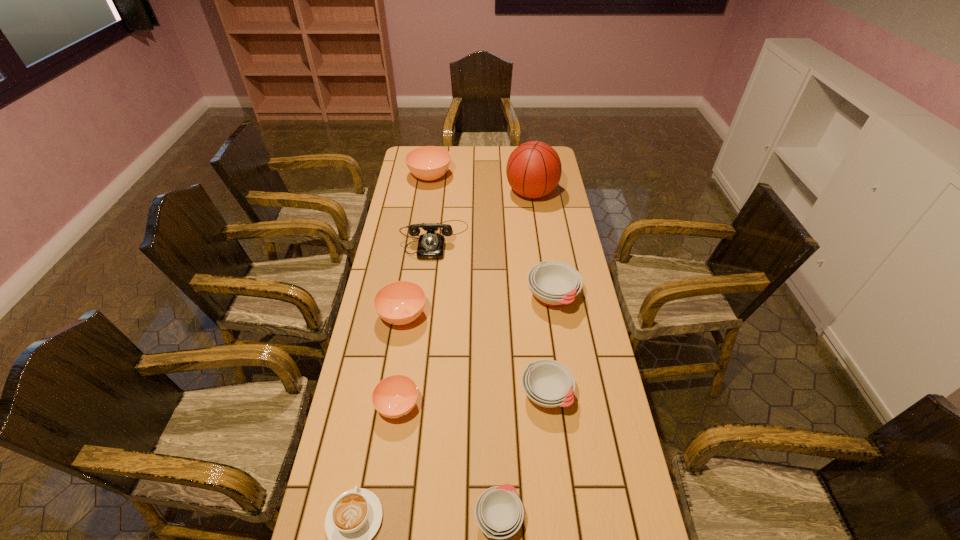
Locate an element on the screen. This screenshot has width=960, height=540. the tallest object is located at coordinates (533, 170).

The image size is (960, 540). I want to click on the farthest soup bowl, so click(x=428, y=163).

This screenshot has width=960, height=540. I want to click on the biggest peach soup bowl, so click(x=428, y=163).

The height and width of the screenshot is (540, 960). What are the coordinates of `telephone` in the screenshot? It's located at [431, 245].

Locate an element on the screen. The image size is (960, 540). the farthest white soup bowl is located at coordinates (554, 283).

At what (x,y) coordinates should I click in order to perform the action: click on the second biggest peach soup bowl. Please return your answer as a coordinate pair (x, y). Image resolution: width=960 pixels, height=540 pixels. Looking at the image, I should click on (399, 303).

Find the location of a particular element. This screenshot has height=540, width=960. the second farthest white soup bowl is located at coordinates (548, 383).

The width and height of the screenshot is (960, 540). In order to click on the smallest peach soup bowl in this screenshot , I will do `click(395, 396)`.

Where is `free space located 0.090m on the front of the tallest object`? The width and height of the screenshot is (960, 540). free space located 0.090m on the front of the tallest object is located at coordinates (536, 222).

You are a GUI agent. You are given a task and a screenshot of the screen. Output one action in this format:
    pyautogui.click(x=<x>, y=<y>)
    Task: Click on the free space located on the right of the farthest soup bowl
    The height and width of the screenshot is (540, 960).
    Given the screenshot: What is the action you would take?
    pyautogui.click(x=528, y=177)